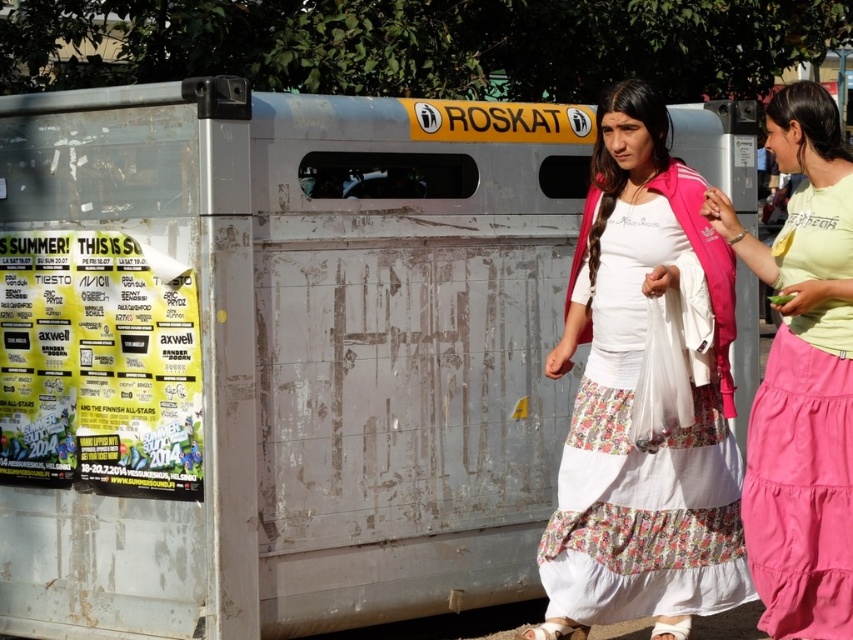
You are a fashion designer observing two outfits in an image. You see a white cotton dress at center and a light green cotton shirt at right. Which outfit takes up more space in the image?

The white cotton dress at center is bigger than the light green cotton shirt at right, so it takes up more space in the image.

From the picture: You are a photographer standing in front of the trash bin labeled ROSKAT. You see a white cotton dress at center and a light green cotton shirt at right. If you want to take a photo that includes both items, will they fit within a 40 cm wide camera frame?

The white cotton dress at center and light green cotton shirt at right are 41.87 centimeters apart from each other, which is wider than the 40 cm camera frame. Therefore, they will not fit within the frame.